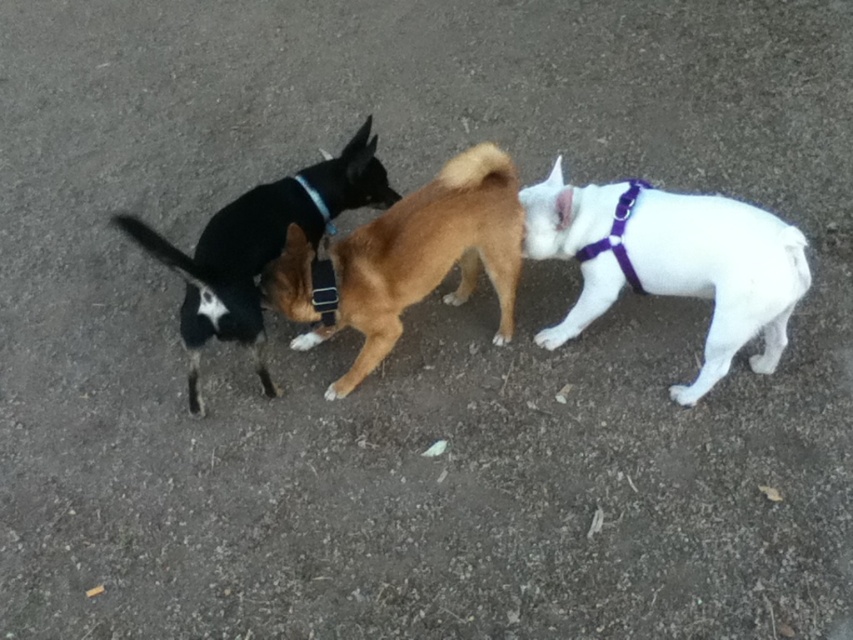
You are a dog owner trying to choose between a white matte harness at right and a black leather dog at center for your pet. Based on the image, which one has a greater width?

The white matte harness at right might be wider than black leather dog at center according to the image description.